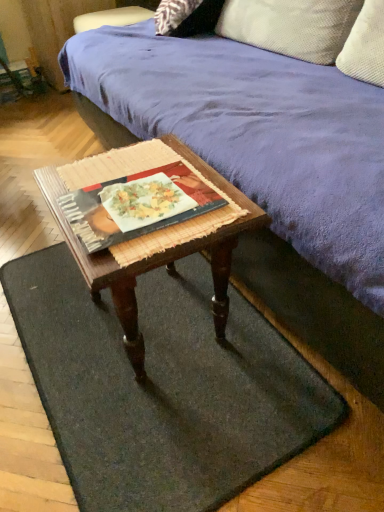
Question: Considering the relative sizes of woven wood coffee table at center and textured beige pillow at upper right in the image provided, is woven wood coffee table at center wider than textured beige pillow at upper right?

Choices:
 (A) yes
 (B) no

Answer: (A)

Question: Considering the relative sizes of woven wood coffee table at center and textured beige pillow at upper right in the image provided, is woven wood coffee table at center thinner than textured beige pillow at upper right?

Choices:
 (A) yes
 (B) no

Answer: (B)

Question: Does woven wood coffee table at center appear on the left side of textured beige pillow at upper right?

Choices:
 (A) no
 (B) yes

Answer: (B)

Question: Is woven wood coffee table at center bigger than textured beige pillow at upper right?

Choices:
 (A) yes
 (B) no

Answer: (B)

Question: From the image's perspective, would you say woven wood coffee table at center is shown under textured beige pillow at upper right?

Choices:
 (A) no
 (B) yes

Answer: (B)

Question: Is woven wood coffee table at center in contact with textured beige pillow at upper right?

Choices:
 (A) no
 (B) yes

Answer: (A)

Question: Is purple suede couch at upper center next to textured beige pillow at upper right and touching it?

Choices:
 (A) yes
 (B) no

Answer: (B)

Question: Is purple suede couch at upper center further to the viewer compared to textured beige pillow at upper right?

Choices:
 (A) yes
 (B) no

Answer: (B)

Question: Is purple suede couch at upper center to the left of textured beige pillow at upper right from the viewer's perspective?

Choices:
 (A) yes
 (B) no

Answer: (A)

Question: Does purple suede couch at upper center have a larger size compared to textured beige pillow at upper right?

Choices:
 (A) no
 (B) yes

Answer: (B)

Question: From a real-world perspective, is purple suede couch at upper center located beneath textured beige pillow at upper right?

Choices:
 (A) yes
 (B) no

Answer: (A)

Question: Considering the relative sizes of purple suede couch at upper center and textured beige pillow at upper right in the image provided, is purple suede couch at upper center shorter than textured beige pillow at upper right?

Choices:
 (A) yes
 (B) no

Answer: (B)

Question: Does matte black book at center have a lesser height compared to green felt doormat at lower center?

Choices:
 (A) yes
 (B) no

Answer: (A)